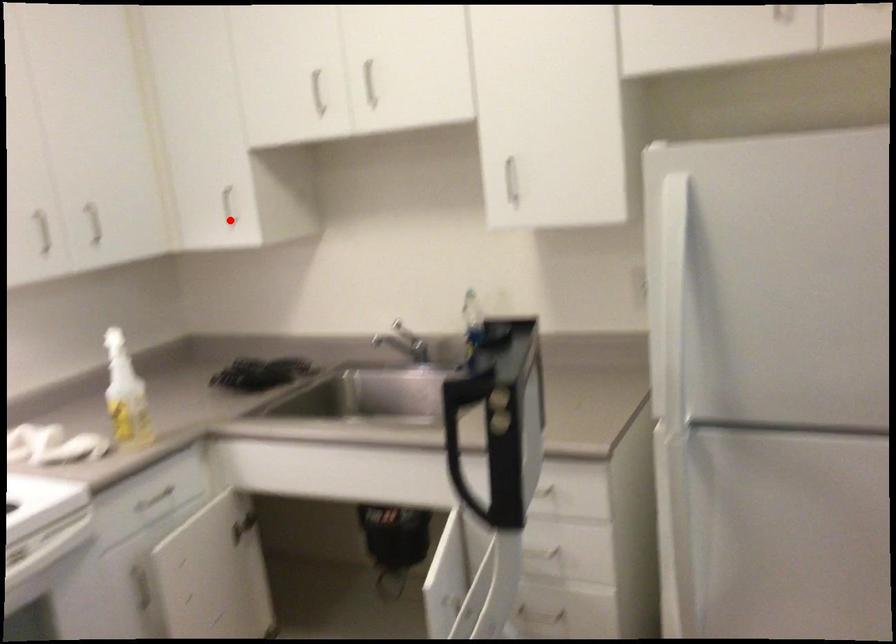
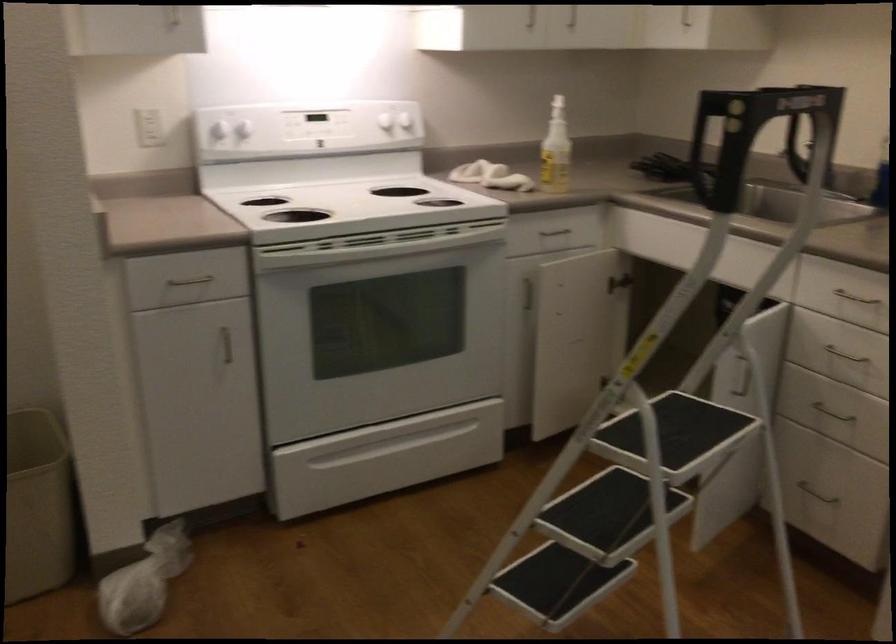
The point at the highlighted location is marked in the first image. Where is the corresponding point in the second image?

(685, 19)